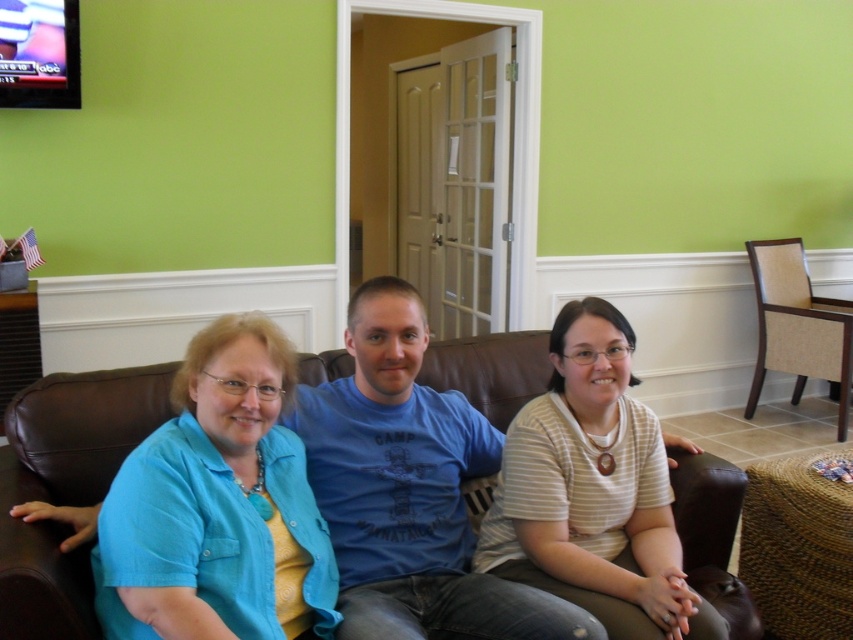
Question: Estimate the real-world distances between objects in this image. Which object is farther from the white striped shirt at center?

Choices:
 (A) blue cotton t-shirt at center
 (B) brown leather couch at center
 (C) blue cotton shirt at left
 (D) brown fabric armchair at right

Answer: (D)

Question: Is brown leather couch at center positioned in front of white striped shirt at center?

Choices:
 (A) yes
 (B) no

Answer: (A)

Question: Is blue cotton t-shirt at center behind brown fabric armchair at right?

Choices:
 (A) yes
 (B) no

Answer: (B)

Question: Which of the following is the farthest from the observer?

Choices:
 (A) (109, 394)
 (B) (491, 467)
 (C) (512, 419)

Answer: (B)

Question: Which object is the closest to the blue cotton t-shirt at center?

Choices:
 (A) brown fabric armchair at right
 (B) brown leather couch at center

Answer: (B)

Question: Is blue cotton t-shirt at center to the left of brown leather couch at center from the viewer's perspective?

Choices:
 (A) no
 (B) yes

Answer: (A)